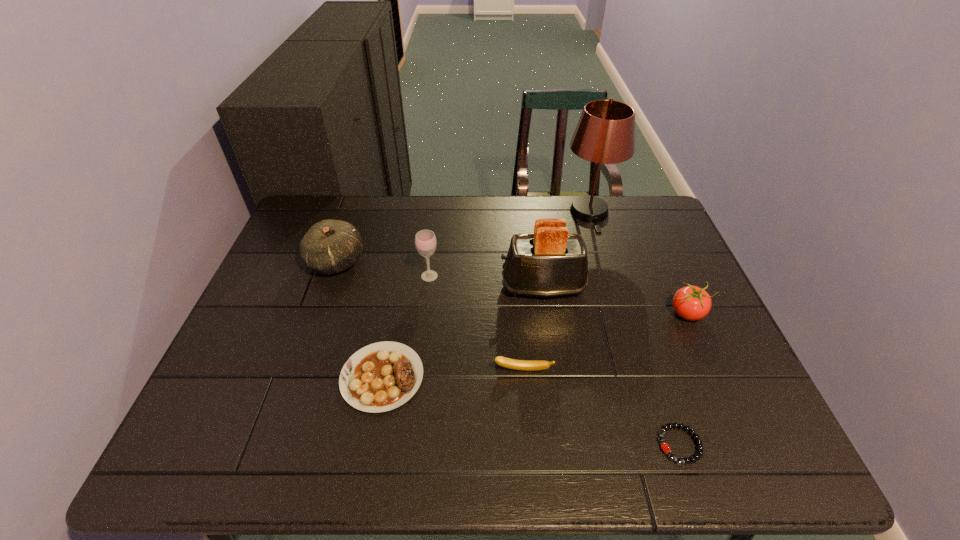
Image resolution: width=960 pixels, height=540 pixels. I want to click on vacant area between the wineglass and the third shortest object, so click(476, 323).

At what (x,y) coordinates should I click in order to perform the action: click on free space between the second tallest object and the tomato. Please return your answer as a coordinate pair (x, y). This screenshot has width=960, height=540. Looking at the image, I should click on (615, 300).

Where is `object that stands as the fifth closest to the banana`? The width and height of the screenshot is (960, 540). object that stands as the fifth closest to the banana is located at coordinates (692, 303).

Locate an element on the screen. The height and width of the screenshot is (540, 960). the third closest object to the nearest object is located at coordinates (550, 262).

The height and width of the screenshot is (540, 960). Identify the location of blank space that satisfies the following two spatial constraints: 1. on the side of the fourth shortest object with the control lever; 2. on the right side of the second tallest object. (546, 314).

Where is `vacant region that satisfies the following two spatial constraints: 1. on the front-facing side of the farthest object; 2. on the right side of the bracelet`? Image resolution: width=960 pixels, height=540 pixels. vacant region that satisfies the following two spatial constraints: 1. on the front-facing side of the farthest object; 2. on the right side of the bracelet is located at coordinates (660, 444).

I want to click on vacant area that satisfies the following two spatial constraints: 1. on the side of the toaster with the control lever; 2. at the stem of the third shortest object, so click(555, 370).

You are a GUI agent. You are given a task and a screenshot of the screen. Output one action in this format:
    pyautogui.click(x=<x>, y=<y>)
    Task: Click on the vacant region that satisfies the following two spatial constraints: 1. on the front side of the wineglass; 2. on the right side of the tomato
    This screenshot has height=540, width=960.
    Given the screenshot: What is the action you would take?
    (425, 314)

This screenshot has height=540, width=960. In order to click on vacant space that satisfies the following two spatial constraints: 1. on the front-facing side of the nearest object; 2. on the right side of the lampshade in this screenshot , I will do `click(660, 444)`.

At what (x,y) coordinates should I click in order to perform the action: click on blank area in the image that satisfies the following two spatial constraints: 1. on the front side of the steak; 2. on the left side of the nearest object. Please return your answer as a coordinate pair (x, y). The height and width of the screenshot is (540, 960). Looking at the image, I should click on (370, 444).